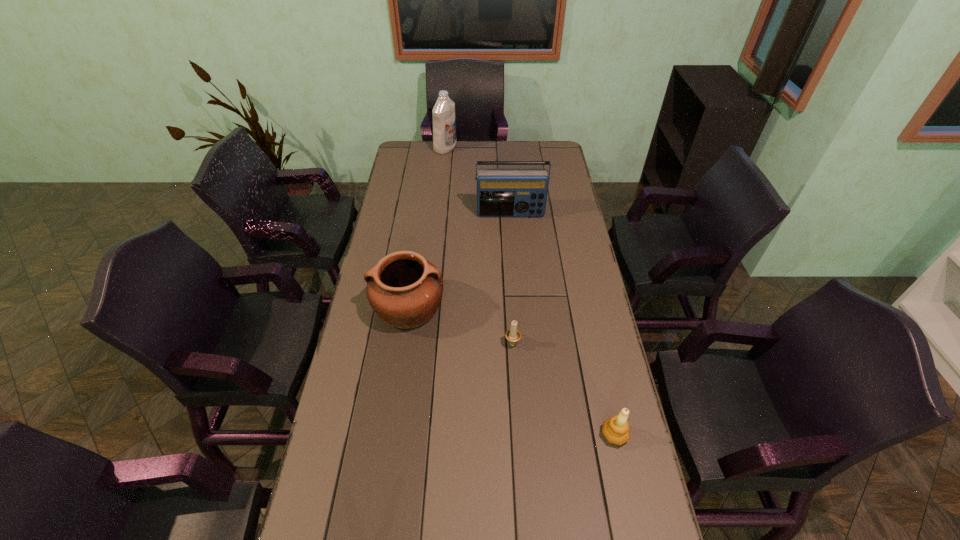
Where is `detergent`? The image size is (960, 540). detergent is located at coordinates tap(444, 121).

What are the coordinates of `the farthest object` in the screenshot? It's located at (444, 121).

Where is `the second farthest object`? This screenshot has height=540, width=960. the second farthest object is located at coordinates (500, 192).

You are a GUI agent. You are given a task and a screenshot of the screen. Output one action in this format:
    pyautogui.click(x=<x>, y=<y>)
    Task: Click on the radio receiver
    This screenshot has height=540, width=960.
    Given the screenshot: What is the action you would take?
    pyautogui.click(x=500, y=192)

Locate an element on the screen. the third shortest object is located at coordinates [404, 289].

Identify the location of the rightmost object. [616, 430].

This screenshot has height=540, width=960. I want to click on the nearest object, so click(x=616, y=430).

Find the location of a particular element. The height and width of the screenshot is (540, 960). the left candle_holder is located at coordinates (513, 335).

At what (x,y) coordinates should I click in order to perform the action: click on the farther candle_holder. Please return your answer as a coordinate pair (x, y). This screenshot has height=540, width=960. Looking at the image, I should click on (513, 335).

Identify the location of vacant space located 0.080m on the front of the detergent. (444, 164).